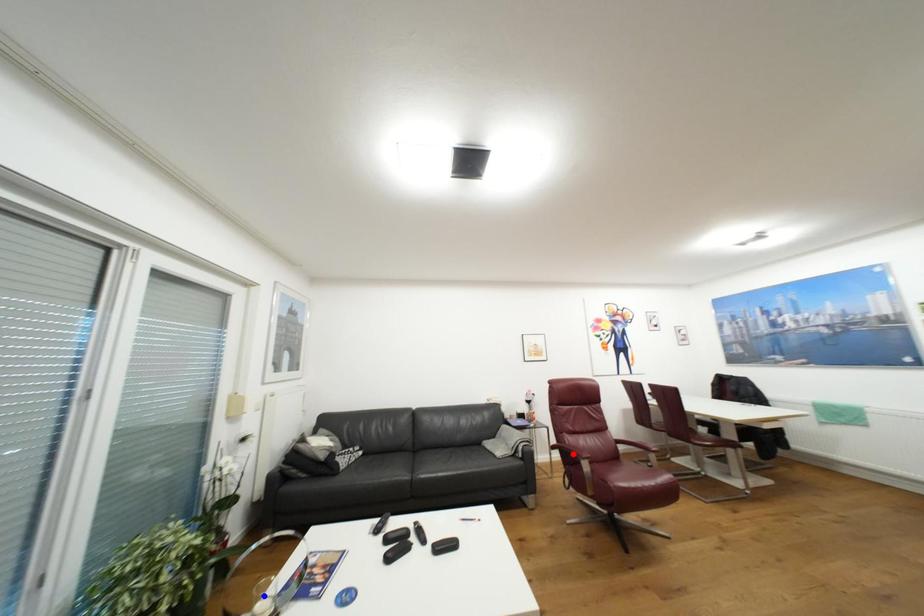
Question: Two points are marked on the image. Which point is closer to the camera?

Choices:
 (A) Blue point is closer.
 (B) Red point is closer.

Answer: (A)